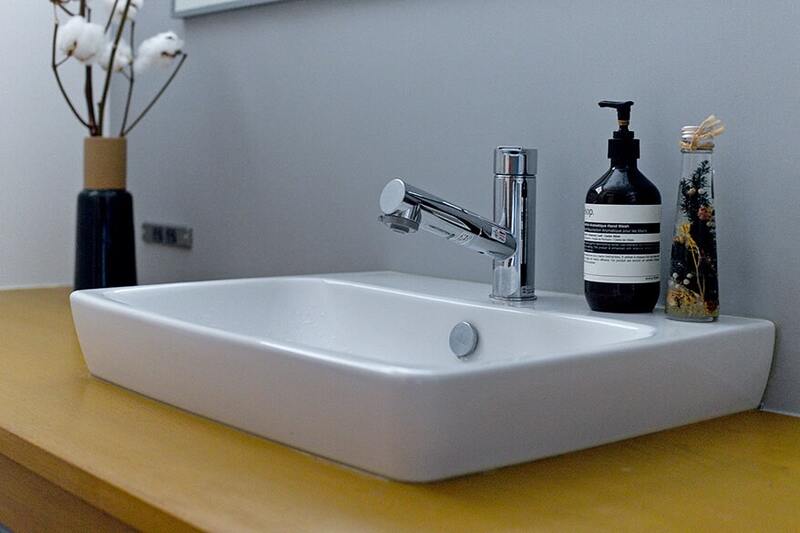
I want to click on wall, so 384,67.